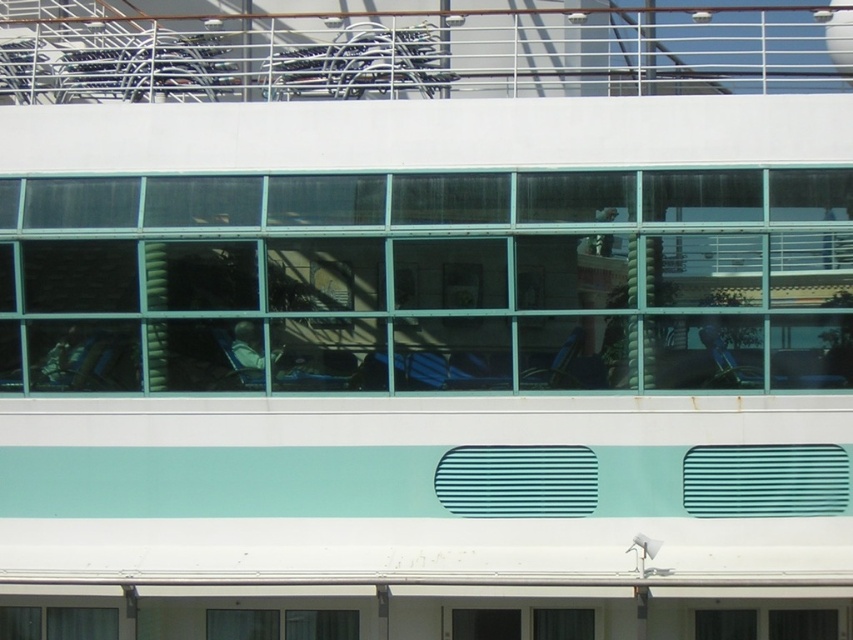
Between point (106, 221) and point (303, 609), which one is positioned behind?

The point (303, 609) is behind.

Is transparent glass windows at center further to the viewer compared to clear glass window at lower center?

No, transparent glass windows at center is closer to the viewer.

Looking at this image, measure the distance between point (x=236, y=212) and camera.

Point (x=236, y=212) is 25.65 meters away from camera.

What are the coordinates of `transparent glass windows at center` in the screenshot? It's located at (434, 282).

Between white metal railing at upper center and clear glass window at lower center, which one is positioned higher?

Positioned higher is white metal railing at upper center.

Is white metal railing at upper center closer to the viewer compared to clear glass window at lower center?

Yes, it is.

Which is behind, point (715, 49) or point (228, 634)?

The point (715, 49) is behind.

The image size is (853, 640). Identify the location of white metal railing at upper center. (415, 51).

Is transparent glass windows at center taller than white metal railing at upper center?

Incorrect, transparent glass windows at center's height is not larger of white metal railing at upper center's.

Is transparent glass windows at center smaller than white metal railing at upper center?

Indeed, transparent glass windows at center has a smaller size compared to white metal railing at upper center.

Is point (36, 237) positioned behind point (305, 35)?

No, (36, 237) is closer to viewer.

Identify the location of transparent glass windows at center. (434, 282).